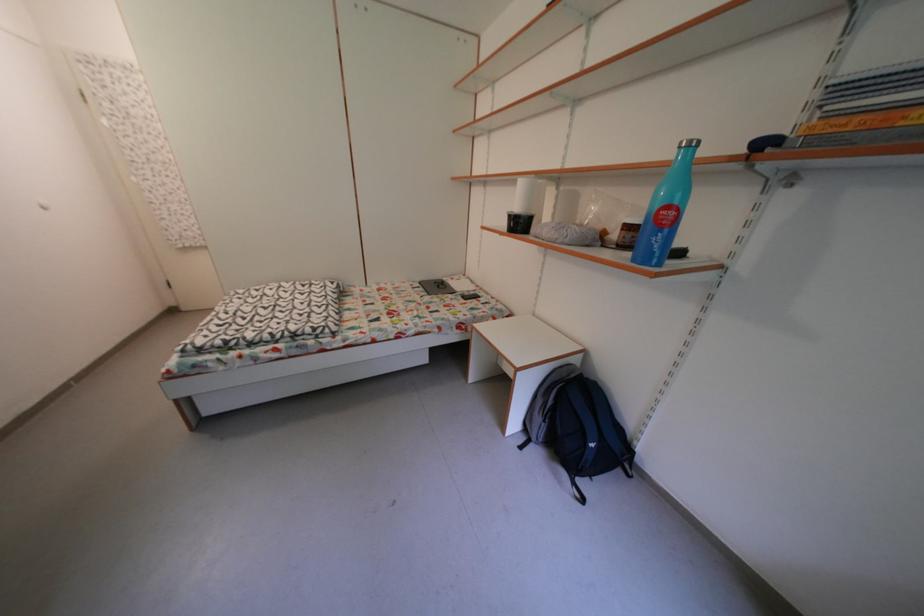
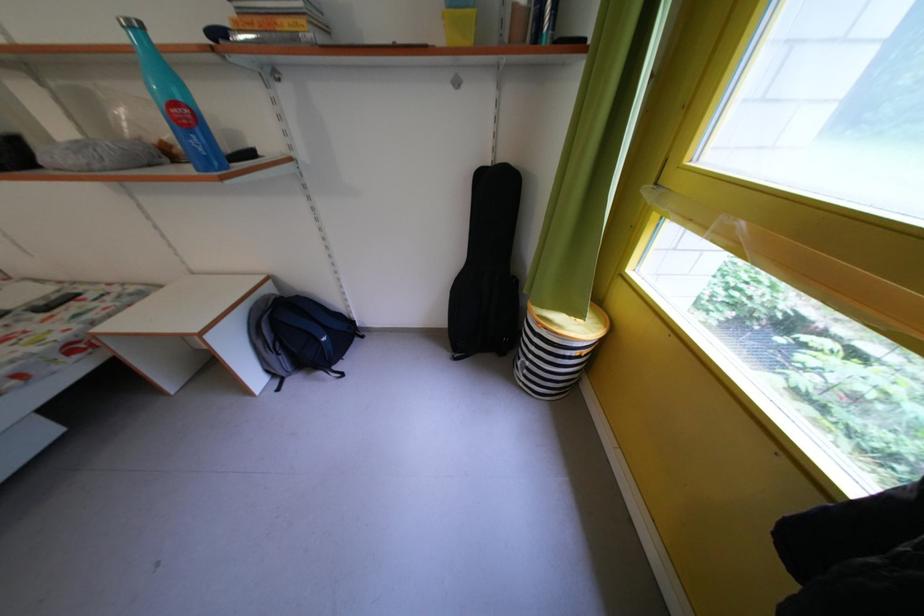
Locate, in the second image, the point that corresponds to point (678, 214) in the first image.

(185, 110)